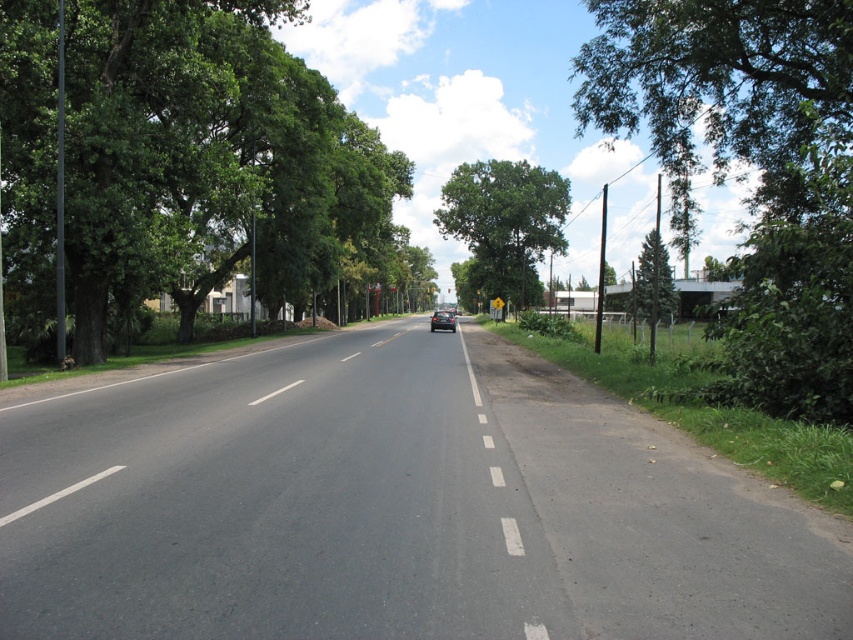
Is yellow reflective plastic at center bigger than white asphalt road at center?

Correct, yellow reflective plastic at center is larger in size than white asphalt road at center.

How much distance is there between yellow reflective plastic at center and white asphalt road at center?

yellow reflective plastic at center and white asphalt road at center are 53.03 meters apart.

Between point (502, 305) and point (350, 358), which one is positioned in front?

Point (350, 358)

This screenshot has width=853, height=640. I want to click on yellow reflective plastic at center, so click(x=496, y=308).

Who is more forward, (x=434, y=314) or (x=265, y=397)?

Positioned in front is point (x=265, y=397).

Based on the photo, is glossy black car at center behind white smooth line at center?

That is True.

Describe the element at coordinates (442, 321) in the screenshot. I see `glossy black car at center` at that location.

Locate an element on the screen. glossy black car at center is located at coordinates [442, 321].

Image resolution: width=853 pixels, height=640 pixels. I want to click on green leafy tree at right, so click(753, 164).

Is green leafy tree at right in front of white asphalt line at lower left?

No, green leafy tree at right is behind white asphalt line at lower left.

Does point (798, 408) come behind point (30, 509)?

Yes, point (798, 408) is behind point (30, 509).

The image size is (853, 640). I want to click on green leafy tree at right, so click(753, 164).